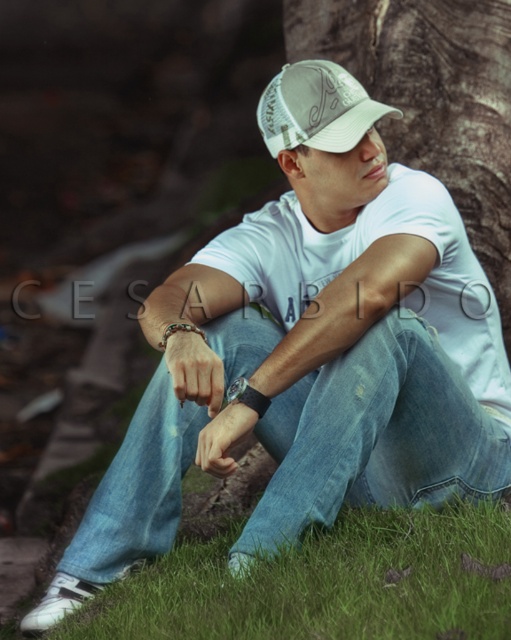
Which of these two, denim jeans at center or white mesh cap at center, stands taller?

Standing taller between the two is denim jeans at center.

Which is above, denim jeans at center or white mesh cap at center?

Positioned higher is white mesh cap at center.

Who is more distant from viewer, (147, 513) or (299, 131)?

Positioned behind is point (147, 513).

The height and width of the screenshot is (640, 511). Identify the location of denim jeans at center. (375, 436).

Describe the element at coordinates (195, 369) in the screenshot. This screenshot has height=640, width=511. I see `leather bracelet at lower center` at that location.

Is point (198, 368) less distant than point (261, 416)?

Yes, point (198, 368) is closer to viewer.

You are a GUI agent. You are given a task and a screenshot of the screen. Output one action in this format:
    pyautogui.click(x=<x>, y=<y>)
    Task: Click on the leather bracelet at lower center
    This screenshot has height=640, width=511.
    Given the screenshot: What is the action you would take?
    pyautogui.click(x=195, y=369)

Who is lower down, leather bracelet at lower center or multicolored beaded bracelet at wrist?

leather bracelet at lower center

Between leather bracelet at lower center and multicolored beaded bracelet at wrist, which one has less height?

With less height is multicolored beaded bracelet at wrist.

Does point (201, 342) lie behind point (183, 324)?

No, it is not.

Where is `leather bracelet at lower center`? This screenshot has height=640, width=511. leather bracelet at lower center is located at coordinates (195, 369).